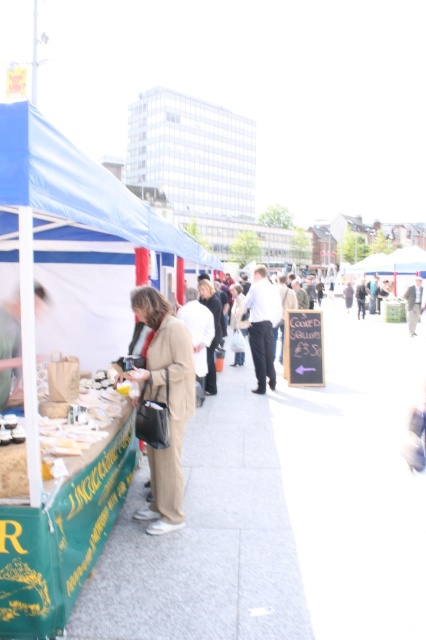
Question: Does blue fabric canopy at left appear over beige fabric coat at center?

Choices:
 (A) no
 (B) yes

Answer: (B)

Question: Can you confirm if smooth concrete pavement at lower center is thinner than white fabric street vendor at center?

Choices:
 (A) no
 (B) yes

Answer: (A)

Question: Which object appears farthest from the camera in this image?

Choices:
 (A) smooth concrete pavement at lower center
 (B) beige fabric coat at center

Answer: (B)

Question: Based on their relative distances, which object is farther from the beige fabric coat at center?

Choices:
 (A) white fabric street vendor at center
 (B) smooth concrete pavement at lower center

Answer: (A)

Question: In this image, where is beige fabric coat at center located relative to white fabric street vendor at center?

Choices:
 (A) above
 (B) below

Answer: (B)

Question: Based on their relative distances, which object is nearer to the smooth concrete pavement at lower center?

Choices:
 (A) beige fabric coat at center
 (B) white fabric street vendor at center

Answer: (A)